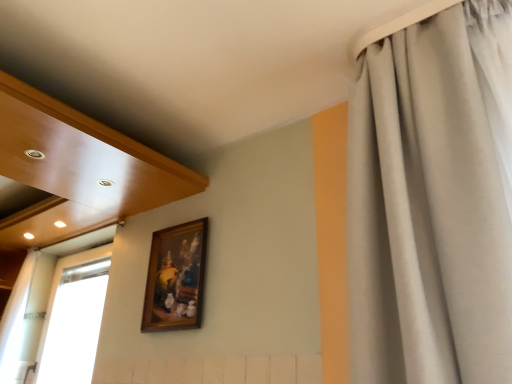
Question: Does white sheer curtain at left, the second curtain positioned from the right, have a greater height compared to wooden frame at upper center?

Choices:
 (A) yes
 (B) no

Answer: (A)

Question: Could you tell me if white sheer curtain at left, which is the second curtain in front-to-back order, is turned towards wooden frame at upper center?

Choices:
 (A) no
 (B) yes

Answer: (A)

Question: Considering the relative positions of white sheer curtain at left, the second curtain positioned from the right, and wooden frame at upper center in the image provided, is white sheer curtain at left, the second curtain positioned from the right, in front of wooden frame at upper center?

Choices:
 (A) yes
 (B) no

Answer: (B)

Question: Is white sheer curtain at left, acting as the second curtain starting from the top, positioned with its back to wooden frame at upper center?

Choices:
 (A) yes
 (B) no

Answer: (B)

Question: From a real-world perspective, does white sheer curtain at left, acting as the second curtain starting from the top, stand above wooden frame at upper center?

Choices:
 (A) yes
 (B) no

Answer: (B)

Question: Does white sheer curtain at left, acting as the second curtain starting from the top, have a greater width compared to wooden frame at upper center?

Choices:
 (A) no
 (B) yes

Answer: (B)

Question: Does white sheer curtain at left contain white sheer curtain at left, acting as the second curtain starting from the top?

Choices:
 (A) no
 (B) yes

Answer: (A)

Question: Is white sheer curtain at left far away from white sheer curtain at left, acting as the second curtain starting from the top?

Choices:
 (A) yes
 (B) no

Answer: (B)

Question: Considering the relative sizes of white sheer curtain at left and white sheer curtain at left, which is the 1th curtain from left to right, in the image provided, is white sheer curtain at left wider than white sheer curtain at left, which is the 1th curtain from left to right,?

Choices:
 (A) yes
 (B) no

Answer: (B)

Question: From a real-world perspective, is white sheer curtain at left on white sheer curtain at left, which is the second curtain in front-to-back order?

Choices:
 (A) no
 (B) yes

Answer: (A)

Question: Is white sheer curtain at left located outside white sheer curtain at left, which is the second curtain in front-to-back order?

Choices:
 (A) no
 (B) yes

Answer: (B)

Question: Is white sheer curtain at left thinner than white sheer curtain at left, acting as the second curtain starting from the top?

Choices:
 (A) yes
 (B) no

Answer: (A)

Question: Is satin gray curtain at right, the 2th curtain positioned from the back, positioned far away from white sheer curtain at left, the 1th curtain positioned from the bottom?

Choices:
 (A) no
 (B) yes

Answer: (B)